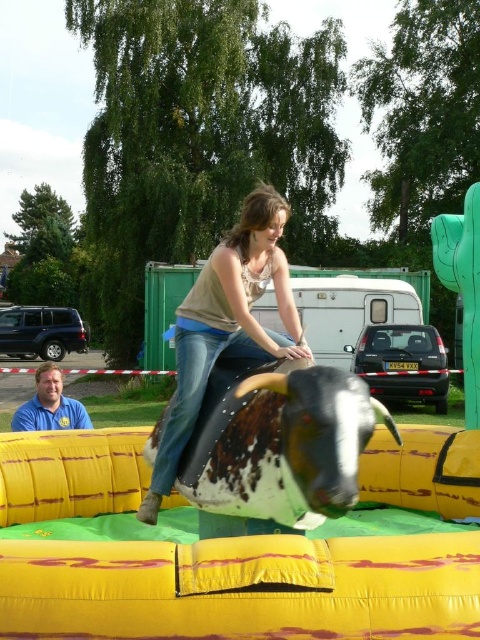
Question: Which point appears farthest from the camera in this image?

Choices:
 (A) (273, 496)
 (B) (20, 422)

Answer: (B)

Question: Which point is closer to the camera taking this photo?

Choices:
 (A) (178, 403)
 (B) (304, 516)
 (C) (38, 368)

Answer: (B)

Question: Does brown textured bull at center have a larger size compared to matte brown leather saddle at center?

Choices:
 (A) no
 (B) yes

Answer: (B)

Question: Which object appears farthest from the camera in this image?

Choices:
 (A) matte brown leather saddle at center
 (B) brown textured bull at center

Answer: (A)

Question: Can you confirm if brown textured bull at center is wider than matte brown leather saddle at center?

Choices:
 (A) yes
 (B) no

Answer: (A)

Question: Is brown textured bull at center below matte brown leather saddle at center?

Choices:
 (A) no
 (B) yes

Answer: (B)